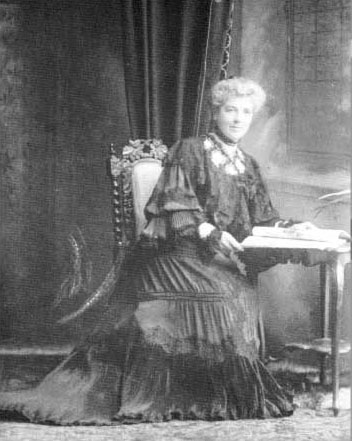
The width and height of the screenshot is (352, 441). I want to click on table, so click(x=303, y=258).